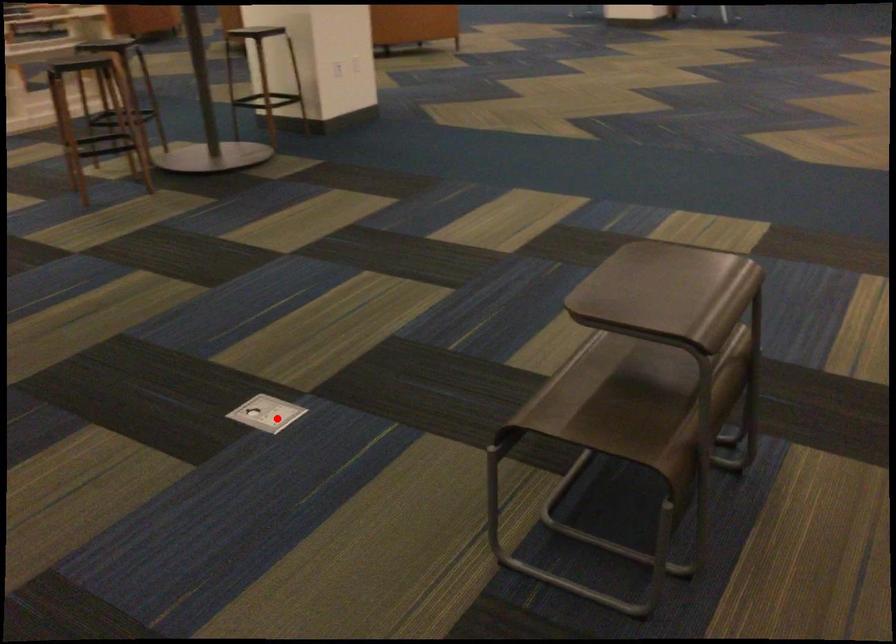
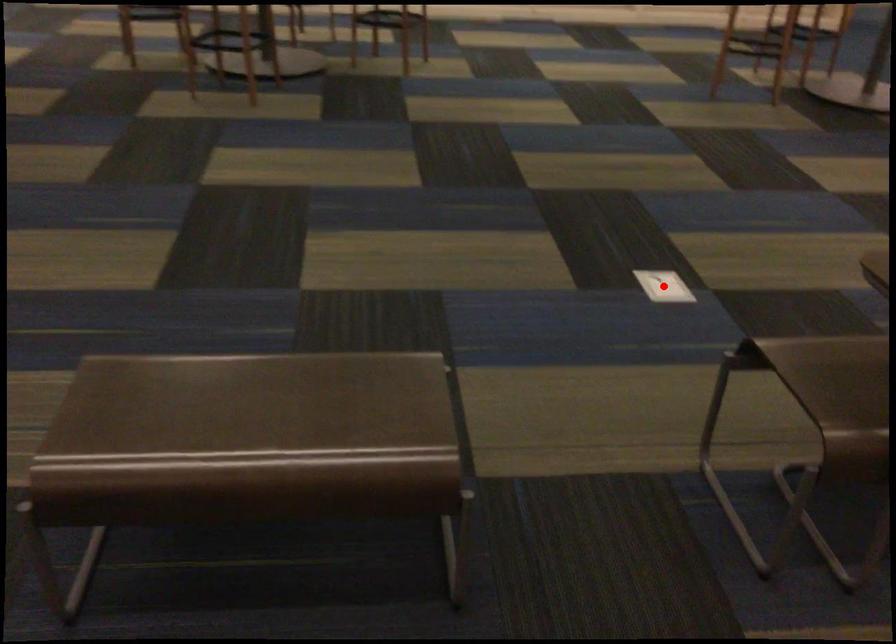
Looking at this image, I am providing you with two images of the same scene from different viewpoints. A red point is marked on the first image and another point is marked on the second image. Are the points marked in image1 and image2 representing the same 3D position?

Yes